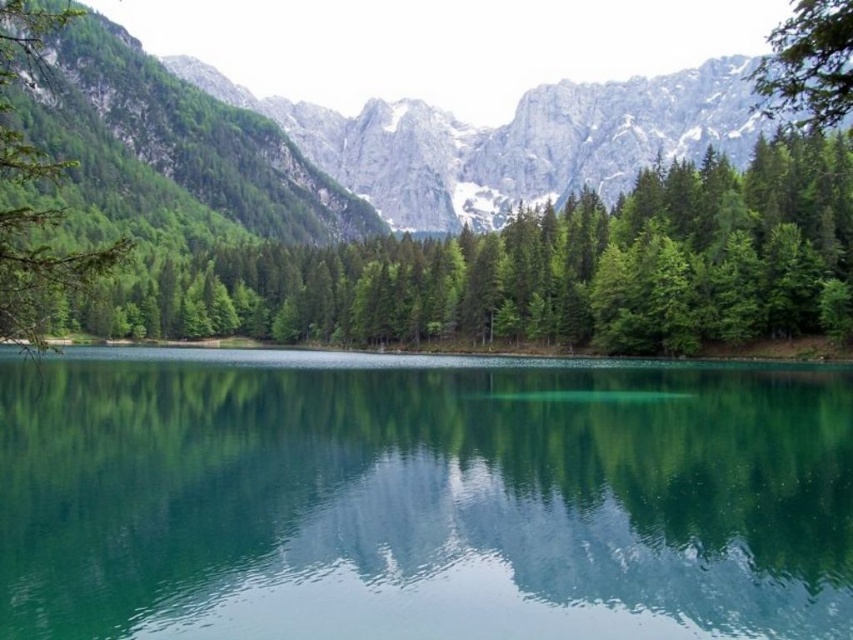
Is green matte tree at upper center wider than green leafy tree at upper right?

Incorrect, green matte tree at upper center's width does not surpass green leafy tree at upper right's.

Between green matte tree at upper center and green leafy tree at upper right, which one appears on the right side from the viewer's perspective?

From the viewer's perspective, green leafy tree at upper right appears more on the right side.

Between point (584, 218) and point (776, 56), which one is positioned in front?

Point (776, 56)

The height and width of the screenshot is (640, 853). What are the coordinates of `green matte tree at upper center` in the screenshot? It's located at (531, 272).

Is green glassy water at center positioned in front of green leafy tree at upper right?

No, green glassy water at center is behind green leafy tree at upper right.

Who is higher up, green glassy water at center or green leafy tree at upper right?

green leafy tree at upper right

At what (x,y) coordinates should I click in order to perform the action: click on green glassy water at center. Please return your answer as a coordinate pair (x, y). This screenshot has height=640, width=853. Looking at the image, I should click on (421, 497).

Which of these two, green matte tree at left or green leafy tree at upper right, stands shorter?

Standing shorter between the two is green matte tree at left.

Where is `green matte tree at left`? green matte tree at left is located at coordinates (39, 272).

Where is `green matte tree at left`? This screenshot has width=853, height=640. green matte tree at left is located at coordinates (39, 272).

Identify the location of green matte tree at left. (39, 272).